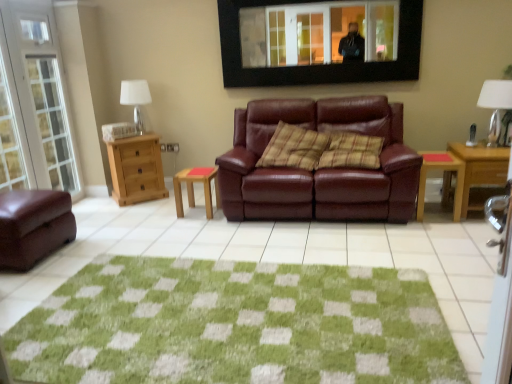
At what (x,y) coordinates should I click in order to perform the action: click on vacant area that lies in front of wooden side table at right, which is counted as the 1th table, starting from the right. Please return your answer as a coordinate pair (x, y). Looking at the image, I should click on [x=448, y=226].